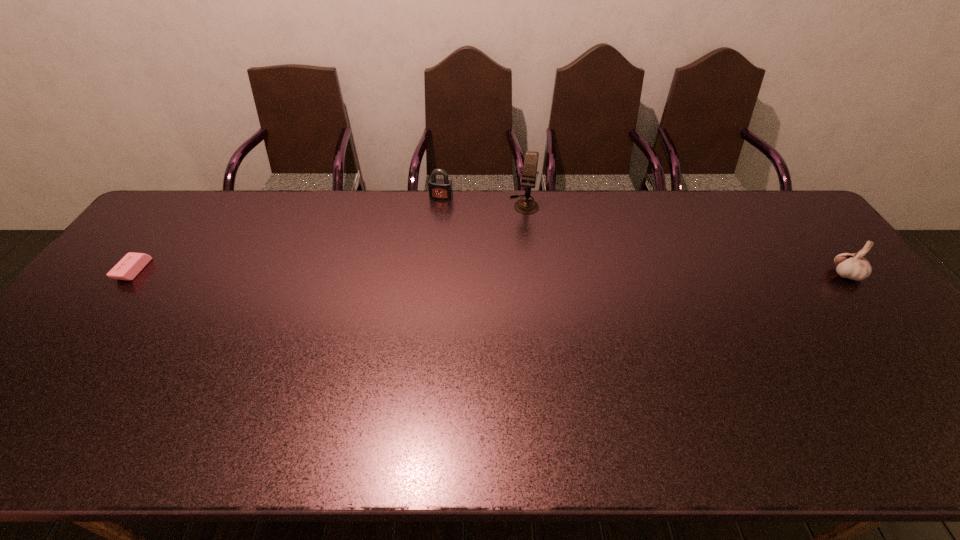
Where is `the leftmost object`? The image size is (960, 540). the leftmost object is located at coordinates (131, 264).

Where is `the shortest object`? The height and width of the screenshot is (540, 960). the shortest object is located at coordinates (131, 264).

What are the coordinates of `garlic` in the screenshot? It's located at (854, 266).

Locate an element on the screen. the third object from left to right is located at coordinates (525, 206).

What are the coordinates of `microphone` in the screenshot? It's located at click(x=525, y=206).

Find the location of a particular element. This screenshot has height=540, width=960. padlock is located at coordinates (441, 189).

I want to click on vacant region located on the front of the leftmost object, so click(34, 400).

The image size is (960, 540). Find the location of `vacant space situated on the front of the rightmost object`. vacant space situated on the front of the rightmost object is located at coordinates (888, 328).

Where is `vacant space located on the front-facing side of the microphone`? vacant space located on the front-facing side of the microphone is located at coordinates (507, 274).

At what (x,y) coordinates should I click in order to perform the action: click on free space located on the front-facing side of the microphone. Please return your answer as a coordinate pair (x, y). The height and width of the screenshot is (540, 960). Looking at the image, I should click on (513, 254).